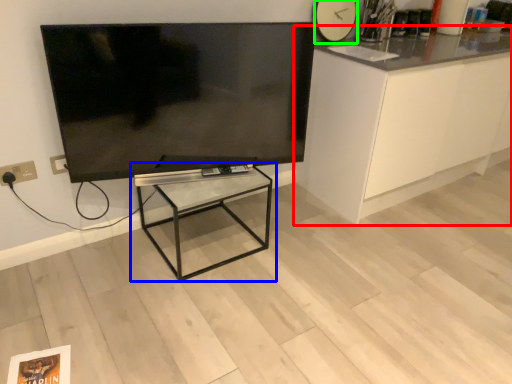
Question: Estimate the real-world distances between objects in this image. Which object is closer to cabinetry (highlighted by a red box), table (highlighted by a blue box) or clock (highlighted by a green box)?

Choices:
 (A) table
 (B) clock

Answer: (B)